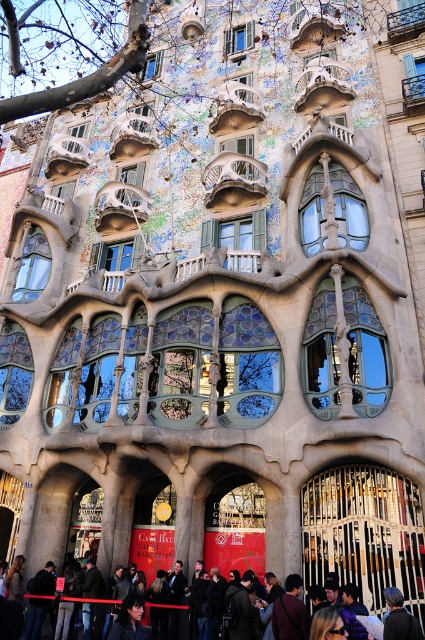
Can you confirm if brown textured tree at upper left is wider than dark brown leather jacket at lower center?

Yes.

The height and width of the screenshot is (640, 425). Describe the element at coordinates (87, 74) in the screenshot. I see `brown textured tree at upper left` at that location.

At what (x,y) coordinates should I click in order to perform the action: click on brown textured tree at upper left. Please return your answer as a coordinate pair (x, y). This screenshot has height=640, width=425. Looking at the image, I should click on (87, 74).